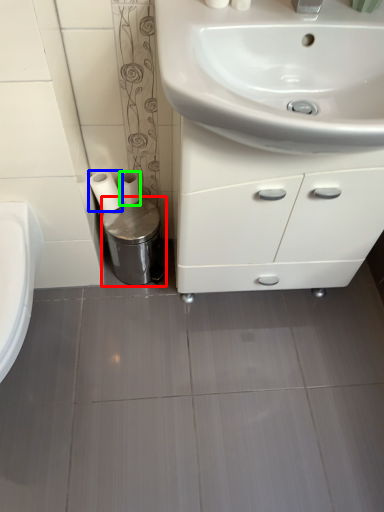
Question: Estimate the real-world distances between objects in this image. Which object is closer to bidet (highlighted by a red box), toilet paper (highlighted by a blue box) or toilet paper (highlighted by a green box)?

Choices:
 (A) toilet paper
 (B) toilet paper

Answer: (B)